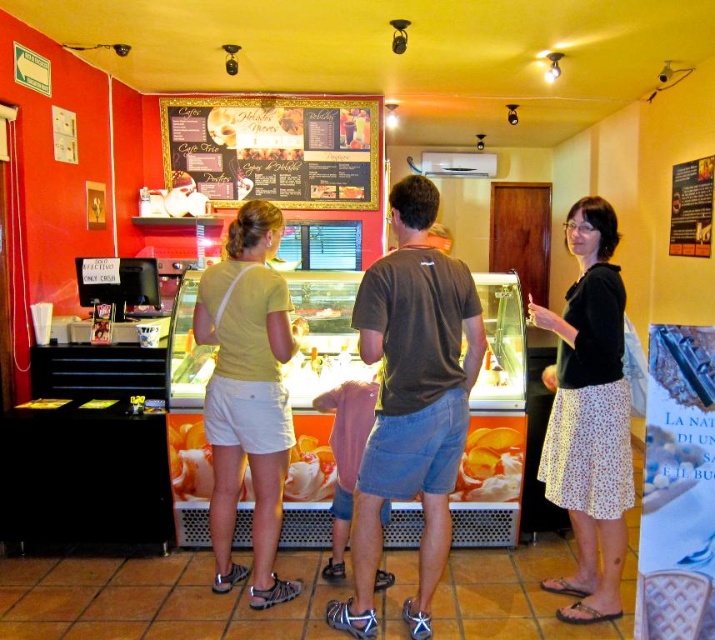
Who is higher up, black cotton skirt at center or wooden menu board at upper center?

wooden menu board at upper center is above.

Does black cotton skirt at center have a larger size compared to wooden menu board at upper center?

Indeed, black cotton skirt at center has a larger size compared to wooden menu board at upper center.

The height and width of the screenshot is (640, 715). Describe the element at coordinates (588, 416) in the screenshot. I see `black cotton skirt at center` at that location.

Locate an element on the screen. black cotton skirt at center is located at coordinates (588, 416).

The width and height of the screenshot is (715, 640). What do you see at coordinates (588, 416) in the screenshot?
I see `black cotton skirt at center` at bounding box center [588, 416].

Can you confirm if black cotton skirt at center is smaller than light beige shorts at center?

No.

Identify the location of black cotton skirt at center. The width and height of the screenshot is (715, 640). (588, 416).

Does light beige shorts at center have a greater width compared to wooden menu board at upper center?

In fact, light beige shorts at center might be narrower than wooden menu board at upper center.

Identify the location of light beige shorts at center. (247, 394).

Locate an element on the screen. light beige shorts at center is located at coordinates (247, 394).

Find the location of a particular element. light beige shorts at center is located at coordinates (247, 394).